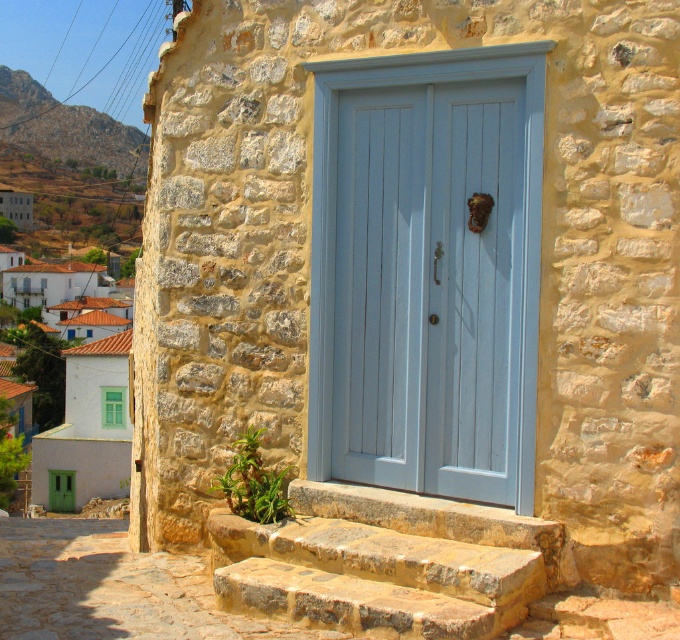
You are a delivery person with a cart that is 50 feet long. You need to park your cart between the natural stone steps at center and the white painted wall at left. Is there enough space for your cart?

The distance between the natural stone steps at center and the white painted wall at left is 45.36 feet, which is less than the cart length of 50 feet. Therefore, the cart cannot be parked between them.

Looking at this image, you are standing at the base of the natural stone steps at center and want to reach the rustic stone hillside at upper left. Which direction should you move to get there?

You should move upward towards the rustic stone hillside at upper left because the natural stone steps at center is below it.

You are standing at the blue door of the rustic stone building. You notice two points marked on the ground in front of you. The first point is at coordinate point [439,564] and the second is at point [118,323]. If you were to walk from the blue door towards the cobblestone pathway, which point would you encounter first?

Point [118,323] would be encountered first because it is positioned behind point [439,564] relative to the blue door. Since the door is the starting point, moving towards the pathway, the point closer to the door along the path would be the first one met. According to the description, point [439,564] is in front of point [118,323], meaning the latter is closer to the door and thus comes first in the direction of travel.